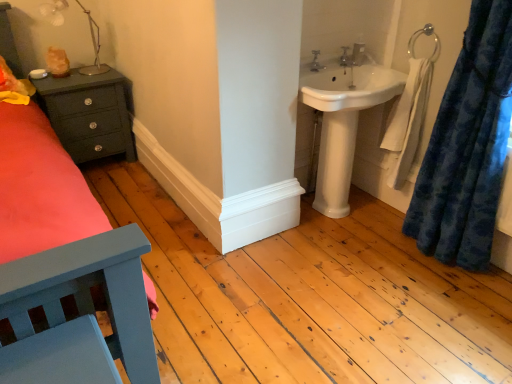
This screenshot has width=512, height=384. What are the coordinates of `matte silver tap at upper center, the second tap viewed from the back` in the screenshot? It's located at (316, 62).

Locate an element on the screen. The image size is (512, 384). matte dark green nightstand at left is located at coordinates (89, 114).

Describe the element at coordinates (347, 58) in the screenshot. The width and height of the screenshot is (512, 384). I see `matte silver tap at upper center, which is the second tap from front to back` at that location.

The height and width of the screenshot is (384, 512). Find the location of `matte silver tap at upper center, the second tap viewed from the back`. matte silver tap at upper center, the second tap viewed from the back is located at coordinates (316, 62).

From a real-world perspective, is matte dark green nightstand at left on matte silver tap at upper center, the 1th tap positioned from the right?

Actually, matte dark green nightstand at left is physically below matte silver tap at upper center, the 1th tap positioned from the right, in the real world.

Is matte dark green nightstand at left not close to matte silver tap at upper center, which is the second tap from front to back?

Yes.

Image resolution: width=512 pixels, height=384 pixels. I want to click on nightstand beneath the matte silver tap at upper center, the 1th tap positioned from the right (from a real-world perspective), so click(89, 114).

Considering the points (114, 99) and (345, 55), which point is behind, point (114, 99) or point (345, 55)?

The point (114, 99) is farther.

Which object is closer to the camera, matte silver tap at upper center, which is the second tap from front to back, or silver metallic towel bar at upper right?

silver metallic towel bar at upper right is more forward.

Locate an element on the screen. The width and height of the screenshot is (512, 384). towel bar above the matte silver tap at upper center, which is the second tap from front to back (from a real-world perspective) is located at coordinates (425, 35).

From the image's perspective, is matte silver tap at upper center, the 1th tap positioned from the right, positioned above or below silver metallic towel bar at upper right?

Based on their image positions, matte silver tap at upper center, the 1th tap positioned from the right, is located beneath silver metallic towel bar at upper right.

Considering the positions of objects matte silver tap at upper center, which is the second tap from front to back, and silver metallic towel bar at upper right in the image provided, who is more to the left, matte silver tap at upper center, which is the second tap from front to back, or silver metallic towel bar at upper right?

From the viewer's perspective, matte silver tap at upper center, which is the second tap from front to back, appears more on the left side.

Can you confirm if matte dark green nightstand at left is bigger than blue plush curtain at right?

Incorrect, matte dark green nightstand at left is not larger than blue plush curtain at right.

From a real-world perspective, is matte dark green nightstand at left located higher than blue plush curtain at right?

No, from a real-world perspective, matte dark green nightstand at left is not over blue plush curtain at right

Is matte dark green nightstand at left thinner than blue plush curtain at right?

No, matte dark green nightstand at left is not thinner than blue plush curtain at right.

Considering the sizes of objects matte dark green nightstand at left and blue plush curtain at right in the image provided, who is shorter, matte dark green nightstand at left or blue plush curtain at right?

matte dark green nightstand at left.

Is silver metallic towel bar at upper right next to matte silver tap at upper center, the second tap viewed from the back, and touching it?

No, silver metallic towel bar at upper right is not with matte silver tap at upper center, the second tap viewed from the back.

Considering the positions of point (408, 48) and point (315, 67), is point (408, 48) closer or farther from the camera than point (315, 67)?

Point (408, 48) is closer to the camera than point (315, 67).

From a real-world perspective, is silver metallic towel bar at upper right positioned under matte silver tap at upper center, the 1th tap positioned from the left, based on gravity?

No, from a real-world perspective, silver metallic towel bar at upper right is not beneath matte silver tap at upper center, the 1th tap positioned from the left.

Can you confirm if silver metallic towel bar at upper right is smaller than matte silver tap at upper center, the 1th tap positioned from the left?

No.

Does matte silver tap at upper center, the second tap positioned from the left, have a lesser width compared to metallic silver lamp at upper left?

Correct, the width of matte silver tap at upper center, the second tap positioned from the left, is less than that of metallic silver lamp at upper left.

From a real-world perspective, is matte silver tap at upper center, arranged as the 1th tap when viewed from the back, on metallic silver lamp at upper left?

No, from a real-world perspective, matte silver tap at upper center, arranged as the 1th tap when viewed from the back, is not on top of metallic silver lamp at upper left.

Based on the photo, is matte silver tap at upper center, arranged as the 1th tap when viewed from the back, bigger than metallic silver lamp at upper left?

Actually, matte silver tap at upper center, arranged as the 1th tap when viewed from the back, might be smaller than metallic silver lamp at upper left.

Is matte silver tap at upper center, which is the second tap from front to back, placed right next to metallic silver lamp at upper left?

No, matte silver tap at upper center, which is the second tap from front to back, is not with metallic silver lamp at upper left.

From their relative heights in the image, would you say white glossy sink at upper right is taller or shorter than silver metallic towel bar at upper right?

Considering their sizes, white glossy sink at upper right has more height than silver metallic towel bar at upper right.

Considering the sizes of white glossy sink at upper right and silver metallic towel bar at upper right in the image, is white glossy sink at upper right wider or thinner than silver metallic towel bar at upper right?

Clearly, white glossy sink at upper right has more width compared to silver metallic towel bar at upper right.

Is point (360, 68) positioned behind point (413, 43)?

Yes, point (360, 68) is farther from viewer.

From the image's perspective, is white glossy sink at upper right located above silver metallic towel bar at upper right?

Actually, white glossy sink at upper right appears below silver metallic towel bar at upper right in the image.

Is white glossy sink at upper right in contact with metallic silver lamp at upper left?

white glossy sink at upper right is not next to metallic silver lamp at upper left, and they're not touching.

Between white glossy sink at upper right and metallic silver lamp at upper left, which one has larger size?

white glossy sink at upper right is bigger.

Is point (345, 68) closer to camera compared to point (50, 13)?

Yes, it is in front of point (50, 13).

Looking at their sizes, would you say white glossy sink at upper right is wider or thinner than metallic silver lamp at upper left?

white glossy sink at upper right is wider than metallic silver lamp at upper left.

Where is `the 2nd tap to the right of the matte dark green nightstand at left, counting from the anchor's position`? the 2nd tap to the right of the matte dark green nightstand at left, counting from the anchor's position is located at coordinates (347, 58).

Identify the location of towel bar located above the matte silver tap at upper center, arranged as the 1th tap when viewed from the back (from the image's perspective). (425, 35).

Considering their positions, is silver metallic towel bar at upper right positioned further to matte silver tap at upper center, the 1th tap positioned from the right, than matte dark green nightstand at left?

matte dark green nightstand at left is further to matte silver tap at upper center, the 1th tap positioned from the right.

Based on their spatial positions, is matte silver tap at upper center, the 1th tap positioned from the left, or white glossy sink at upper right further from blue plush curtain at right?

matte silver tap at upper center, the 1th tap positioned from the left, is positioned further to the anchor blue plush curtain at right.

From the image, which object appears to be nearer to blue plush curtain at right, matte silver tap at upper center, the second tap positioned from the left, or silver metallic towel bar at upper right?

The object closer to blue plush curtain at right is silver metallic towel bar at upper right.

From the picture: From the image, which object appears to be farther from matte silver tap at upper center, which is the second tap from front to back, blue plush curtain at right or silver metallic towel bar at upper right?

blue plush curtain at right.

Which object lies nearer to the anchor point matte dark green nightstand at left, blue plush curtain at right or white glossy sink at upper right?

white glossy sink at upper right.

Considering their positions, is blue plush curtain at right positioned further to silver metallic towel bar at upper right than matte silver tap at upper center, the second tap positioned from the left?

blue plush curtain at right lies further to silver metallic towel bar at upper right than the other object.

Consider the image. Which object lies further to the anchor point metallic silver lamp at upper left, matte dark green nightstand at left or blue plush curtain at right?

blue plush curtain at right.

Looking at the image, which one is located closer to white glossy sink at upper right, matte dark green nightstand at left or blue plush curtain at right?

Among the two, blue plush curtain at right is located nearer to white glossy sink at upper right.

At what (x,y) coordinates should I click in order to perform the action: click on towel bar between white glossy sink at upper right and matte silver tap at upper center, the second tap positioned from the left, in the front-back direction. Please return your answer as a coordinate pair (x, y). This screenshot has height=384, width=512. Looking at the image, I should click on (425, 35).

Where is `tap between matte dark green nightstand at left and matte silver tap at upper center, the second tap positioned from the left`? Image resolution: width=512 pixels, height=384 pixels. tap between matte dark green nightstand at left and matte silver tap at upper center, the second tap positioned from the left is located at coordinates (316, 62).

At what (x,y) coordinates should I click in order to perform the action: click on lamp between matte dark green nightstand at left and matte silver tap at upper center, the second tap viewed from the back, in the horizontal direction. Please return your answer as a coordinate pair (x, y). This screenshot has width=512, height=384. Looking at the image, I should click on (93, 47).

Where is `sink between metallic silver lamp at upper left and blue plush curtain at right from left to right`? sink between metallic silver lamp at upper left and blue plush curtain at right from left to right is located at coordinates (349, 86).